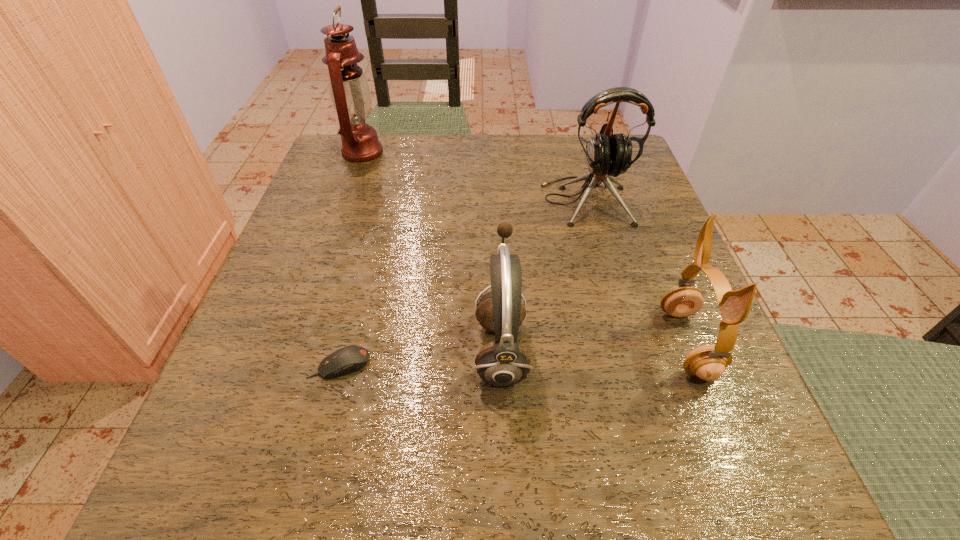
You are a GUI agent. You are given a task and a screenshot of the screen. Output one action in this format:
    pyautogui.click(x=<x>, y=<y>)
    Task: Click on the earphone that is the closest to the oil lamp
    The image size is (960, 540).
    Given the screenshot: What is the action you would take?
    pyautogui.click(x=608, y=154)

The width and height of the screenshot is (960, 540). What are the coordinates of `earphone object that ranks as the third closest to the farthest object` in the screenshot? It's located at (708, 362).

Where is `vacant area in the image that satisfies the following two spatial constraints: 1. on the front side of the fourth shortest object; 2. on the ear pads of the third object from left to right`? vacant area in the image that satisfies the following two spatial constraints: 1. on the front side of the fourth shortest object; 2. on the ear pads of the third object from left to right is located at coordinates (627, 349).

Find the location of a particular element. vacant space that satisfies the following two spatial constraints: 1. on the front side of the tallest object; 2. on the left side of the farthest earphone is located at coordinates (346, 200).

Locate an element on the screen. The image size is (960, 540). vacant space that satisfies the following two spatial constraints: 1. on the back side of the fourth shortest object; 2. on the left side of the computer mouse is located at coordinates coord(382,200).